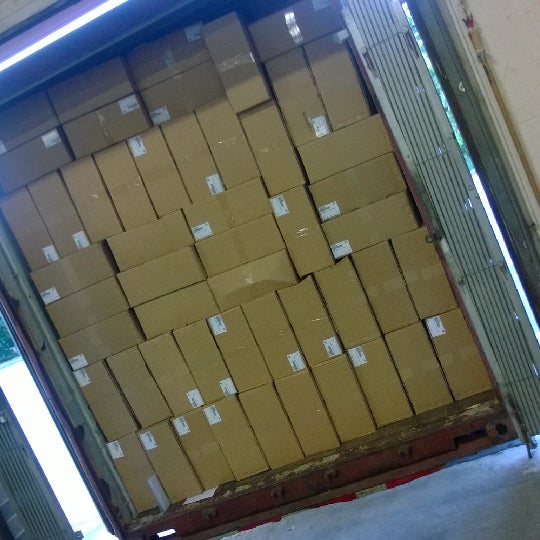
Identify the location of safety gate. tap(497, 318).